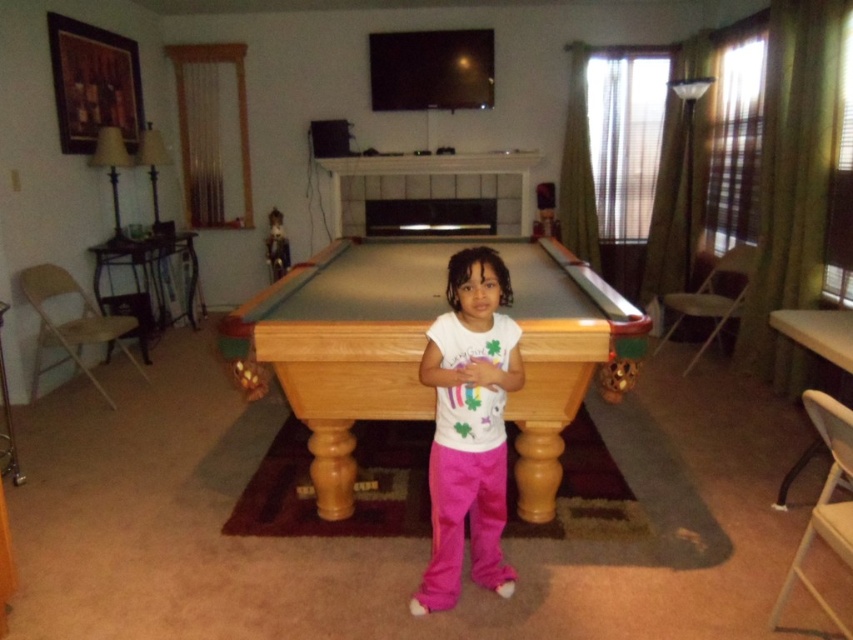
Question: Does light brown wood pool table at center appear on the left side of white cotton shirt at center?

Choices:
 (A) no
 (B) yes

Answer: (B)

Question: Does light brown wood pool table at center appear on the left side of white cotton shirt at center?

Choices:
 (A) no
 (B) yes

Answer: (B)

Question: Which object appears closest to the camera in this image?

Choices:
 (A) white cotton shirt at center
 (B) light brown wood pool table at center

Answer: (A)

Question: Does light brown wood pool table at center appear over white cotton shirt at center?

Choices:
 (A) yes
 (B) no

Answer: (A)

Question: Which of the following is the closest to the observer?

Choices:
 (A) (281, 380)
 (B) (451, 257)

Answer: (B)